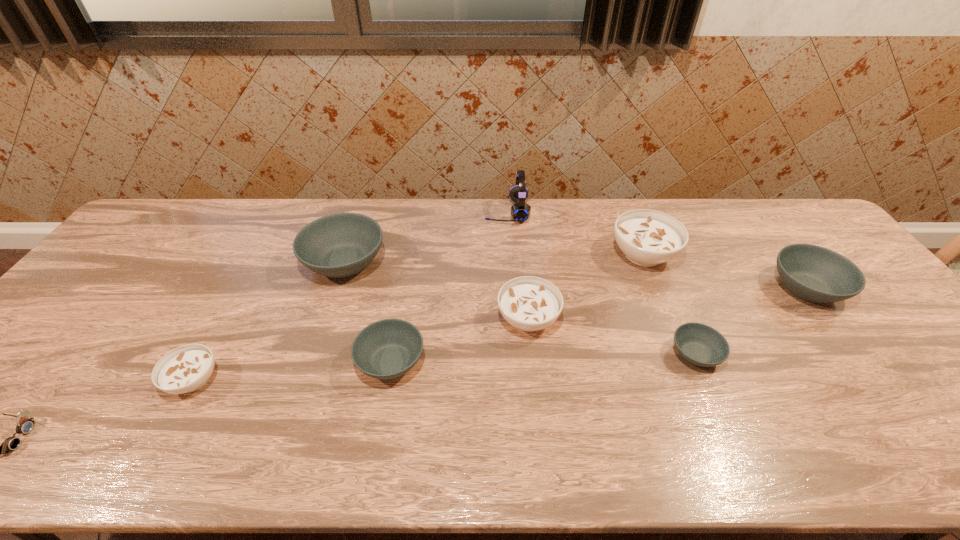
Find the location of a particular element. The image size is (960, 540). free area in between the second white soup bowl from left to right and the biggest gray soup bowl is located at coordinates (437, 291).

This screenshot has height=540, width=960. I want to click on free space between the rightmost soup bowl and the shortest soup bowl, so click(751, 321).

I want to click on blank region between the second white soup bowl from right to left and the third smallest gray soup bowl, so click(667, 303).

In order to click on empty location between the third biggest gray soup bowl and the smallest gray soup bowl in this screenshot , I will do `click(543, 358)`.

The height and width of the screenshot is (540, 960). Find the location of `empty space that is in between the rightmost white soup bowl and the tallest object`. empty space that is in between the rightmost white soup bowl and the tallest object is located at coordinates (575, 233).

This screenshot has height=540, width=960. I want to click on vacant point located between the second smallest white soup bowl and the farthest object, so click(x=517, y=265).

Locate an element on the screen. This screenshot has height=540, width=960. vacant area that lies between the farthest object and the second farthest white soup bowl is located at coordinates (517, 265).

You are a GUI agent. You are given a task and a screenshot of the screen. Output one action in this format:
    pyautogui.click(x=<x>, y=<y>)
    Task: Click on the object that is the fifth closest to the leftmost soup bowl
    
    Given the screenshot: What is the action you would take?
    pyautogui.click(x=520, y=211)

Find the location of a particular element. object that is the seventh closest one to the farthest object is located at coordinates (187, 368).

Select which soup bowl appears as the fourth closest to the headset. Please provide its 2D coordinates. Your answer should be formatted as a tuple, i.e. [(x, y)], where the tuple contains the x and y coordinates of a point satisfying the conditions above.

[(386, 349)]